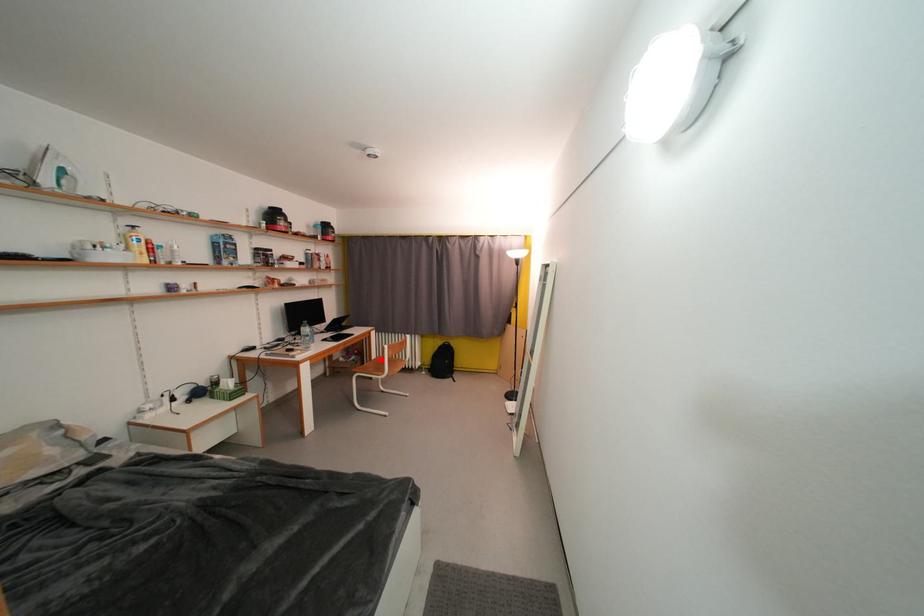
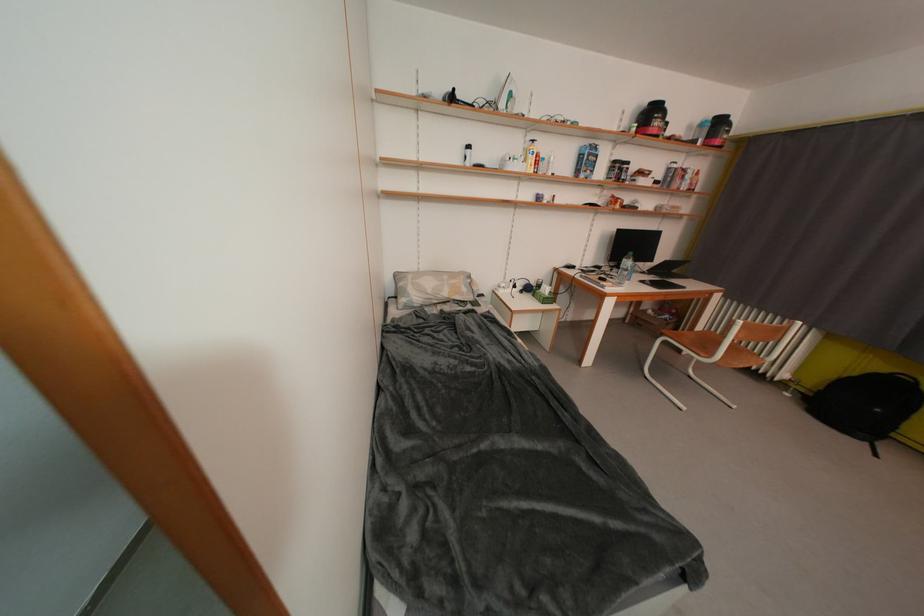
Question: I am providing you with two images of the same scene from different viewpoints. Image1 has a red point marked. In image2, the corresponding 3D location appears at what relative position? Reply with the corresponding letter.

Choices:
 (A) Closer
 (B) Farther

Answer: (A)